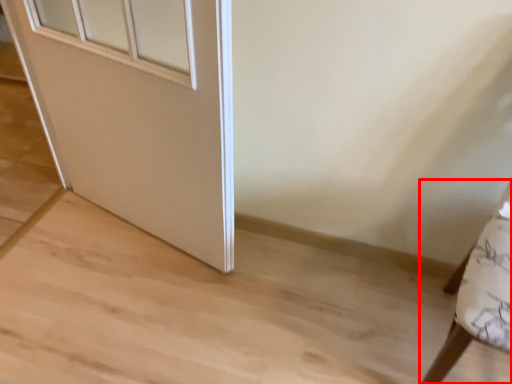
Question: Observing the image, what is the correct spatial positioning of furniture (annotated by the red box) in reference to door?

Choices:
 (A) left
 (B) right

Answer: (B)